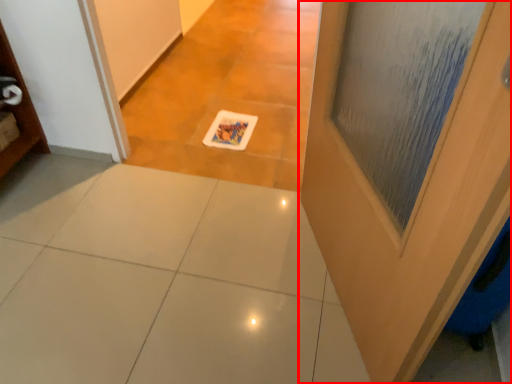
Question: From the image's perspective, where is door (annotated by the red box) located relative to ceramic tile?

Choices:
 (A) below
 (B) above

Answer: (B)